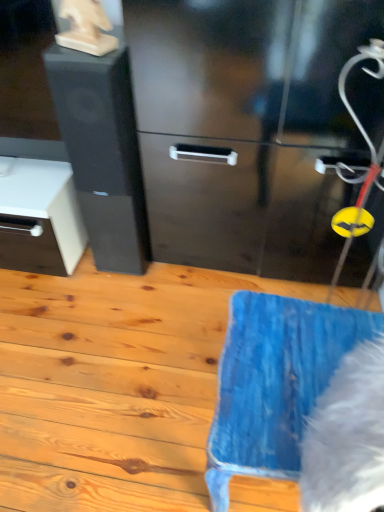
Describe the element at coordinates (102, 152) in the screenshot. I see `black matte/file cabinet at left` at that location.

Describe the element at coordinates (347, 436) in the screenshot. The image size is (384, 512). I see `white fluffy animal at lower right` at that location.

Describe the element at coordinates (113, 384) in the screenshot. I see `blue fabric at lower right` at that location.

The image size is (384, 512). I want to click on black matte/file cabinet at left, so click(x=102, y=152).

From a real-world perspective, is black matte/file cabinet at left under white fluffy animal at lower right?

Correct, in the physical world, black matte/file cabinet at left is lower than white fluffy animal at lower right.

Is point (141, 251) closer or farther from the camera than point (360, 410)?

Point (141, 251) is positioned farther from the camera compared to point (360, 410).

Is black matte/file cabinet at left positioned with its back to white fluffy animal at lower right?

black matte/file cabinet at left does not have its back to white fluffy animal at lower right.

How much distance is there between black matte/file cabinet at left and blue fabric at lower right?

black matte/file cabinet at left and blue fabric at lower right are 45.95 centimeters apart.

This screenshot has width=384, height=512. I want to click on wood in front of the black matte/file cabinet at left, so click(113, 384).

Looking at this image, which is behind, black matte/file cabinet at left or blue fabric at lower right?

black matte/file cabinet at left is further away from the camera.

Which of these two, black matte/file cabinet at left or blue fabric at lower right, stands shorter?

With less height is blue fabric at lower right.

Does point (197, 473) appear closer or farther from the camera than point (371, 509)?

Point (197, 473) is positioned farther from the camera compared to point (371, 509).

From the picture: From a real-world perspective, who is located lower, blue fabric at lower right or white fluffy animal at lower right?

From a 3D spatial view, blue fabric at lower right is below.

Which is more to the left, blue fabric at lower right or white fluffy animal at lower right?

Positioned to the left is blue fabric at lower right.

Would you say blue fabric at lower right is to the left or to the right of black matte/file cabinet at left in the picture?

From the image, it's evident that blue fabric at lower right is to the right of black matte/file cabinet at left.

From a real-world perspective, between blue fabric at lower right and black matte/file cabinet at left, who is vertically higher?

From a 3D spatial view, black matte/file cabinet at left is above.

Does blue fabric at lower right touch black matte/file cabinet at left?

No, blue fabric at lower right is not in contact with black matte/file cabinet at left.

Is blue fabric at lower right spatially inside black matte/file cabinet at left, or outside of it?

blue fabric at lower right is spatially situated outside black matte/file cabinet at left.

From a real-world perspective, who is located lower, white fluffy animal at lower right or black matte/file cabinet at left?

black matte/file cabinet at left, from a real-world perspective.

Where is `animal to the right of black matte/file cabinet at left`? The image size is (384, 512). animal to the right of black matte/file cabinet at left is located at coordinates (347, 436).

Is white fluffy animal at lower right at the right side of black matte/file cabinet at left?

Yes, white fluffy animal at lower right is to the right of black matte/file cabinet at left.

Is white fluffy animal at lower right taller than black matte/file cabinet at left?

Incorrect, the height of white fluffy animal at lower right is not larger of that of black matte/file cabinet at left.

Consider the image. Does white fluffy animal at lower right have a lesser height compared to blue fabric at lower right?

In fact, white fluffy animal at lower right may be taller than blue fabric at lower right.

Considering the relative sizes of white fluffy animal at lower right and blue fabric at lower right in the image provided, is white fluffy animal at lower right wider than blue fabric at lower right?

No, white fluffy animal at lower right is not wider than blue fabric at lower right.

How far apart are white fluffy animal at lower right and blue fabric at lower right?

white fluffy animal at lower right is 29.71 inches away from blue fabric at lower right.

Between white fluffy animal at lower right and blue fabric at lower right, which one has smaller size?

white fluffy animal at lower right.

At what (x,y) coordinates should I click in order to perform the action: click on file cabinet above the white fluffy animal at lower right (from the image's perspective). Please return your answer as a coordinate pair (x, y). Looking at the image, I should click on (x=102, y=152).

The width and height of the screenshot is (384, 512). Identify the location of file cabinet above the blue fabric at lower right (from a real-world perspective). (102, 152).

From the image, which object appears to be nearer to white fluffy animal at lower right, black matte/file cabinet at left or blue fabric at lower right?

The object closer to white fluffy animal at lower right is blue fabric at lower right.

Estimate the real-world distances between objects in this image. Which object is closer to blue fabric at lower right, black matte/file cabinet at left or white fluffy animal at lower right?

black matte/file cabinet at left lies closer to blue fabric at lower right than the other object.

Estimate the real-world distances between objects in this image. Which object is closer to blue fabric at lower right, white fluffy animal at lower right or black matte/file cabinet at left?

black matte/file cabinet at left.

Estimate the real-world distances between objects in this image. Which object is closer to white fluffy animal at lower right, blue fabric at lower right or black matte/file cabinet at left?

Among the two, blue fabric at lower right is located nearer to white fluffy animal at lower right.

Consider the image. Looking at the image, which one is located further to black matte/file cabinet at left, white fluffy animal at lower right or blue fabric at lower right?

Based on the image, white fluffy animal at lower right appears to be further to black matte/file cabinet at left.

Which object lies nearer to the anchor point black matte/file cabinet at left, blue fabric at lower right or white fluffy animal at lower right?

Among the two, blue fabric at lower right is located nearer to black matte/file cabinet at left.

The image size is (384, 512). I want to click on wood between black matte/file cabinet at left and white fluffy animal at lower right in the up-down direction, so click(113, 384).